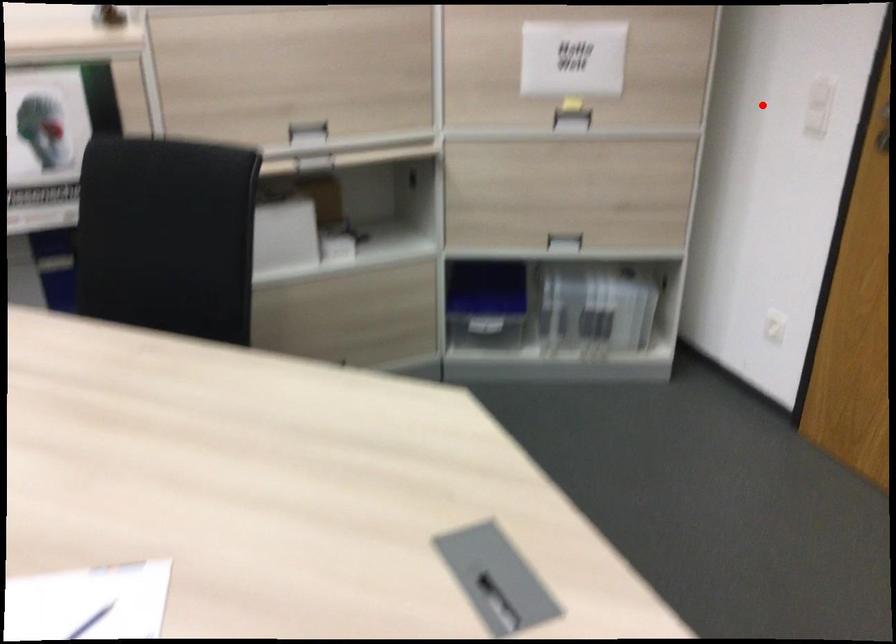
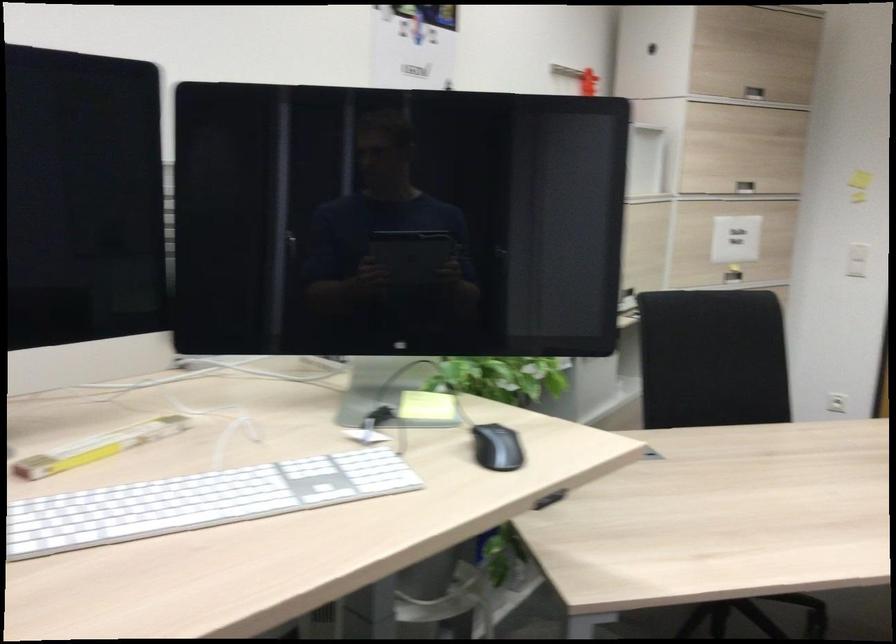
In the second image, find the point that corresponds to the highlighted location in the first image.

(857, 260)